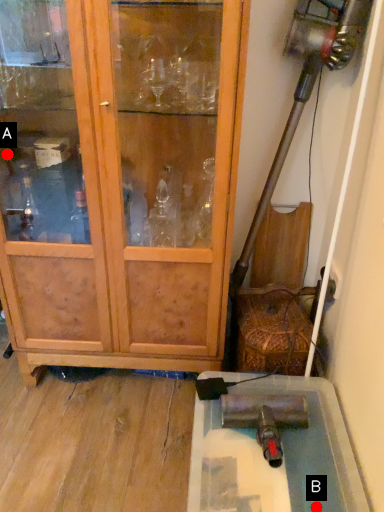
Question: Two points are circled on the image, labeled by A and B beside each circle. Which point appears closest to the camera in this image?

Choices:
 (A) A is closer
 (B) B is closer

Answer: (B)